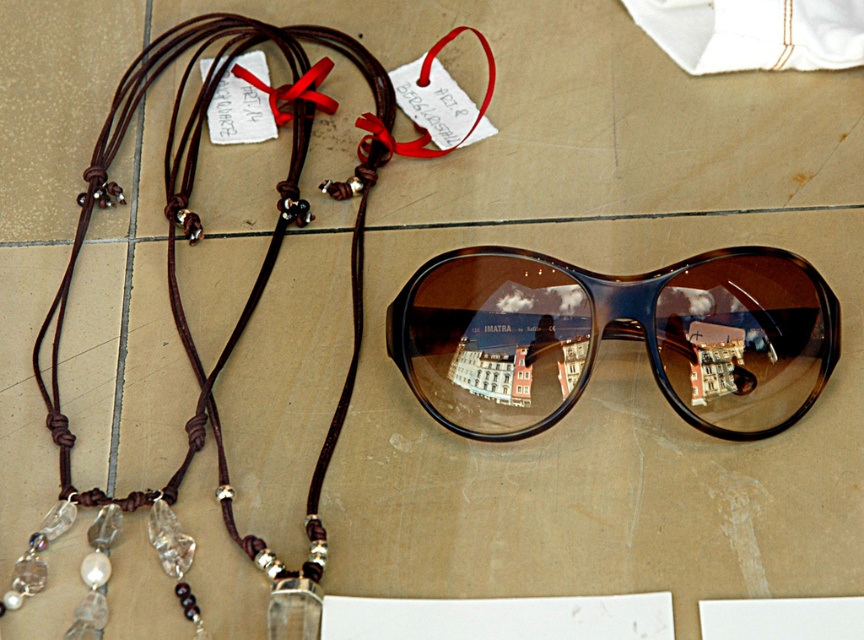
Question: Does brown tortoiseshell sunglasses at center come in front of brown leather necklace at left?

Choices:
 (A) no
 (B) yes

Answer: (A)

Question: Is brown tortoiseshell sunglasses at center to the left of brown leather necklace at left from the viewer's perspective?

Choices:
 (A) yes
 (B) no

Answer: (B)

Question: Which point appears closest to the camera in this image?

Choices:
 (A) (677, 288)
 (B) (49, 314)

Answer: (A)

Question: Is the position of brown tortoiseshell sunglasses at center more distant than that of brown leather necklace at left?

Choices:
 (A) yes
 (B) no

Answer: (A)